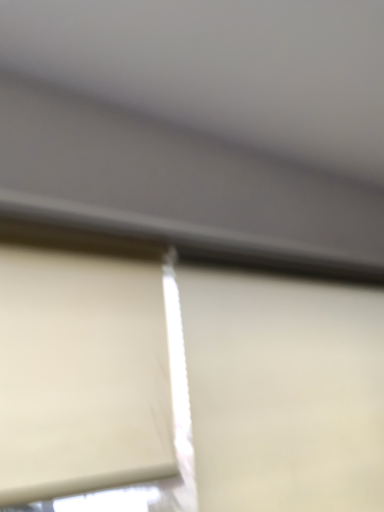
You are a GUI agent. You are given a task and a screenshot of the screen. Output one action in this format:
    pyautogui.click(x=<x>, y=<y>)
    Task: Click on the transparent plastic window at center
    
    Given the screenshot: What is the action you would take?
    pyautogui.click(x=182, y=381)

This screenshot has height=512, width=384. Describe the element at coordinates (182, 381) in the screenshot. I see `transparent plastic window at center` at that location.

Locate an element on the screen. transparent plastic window at center is located at coordinates (182, 381).